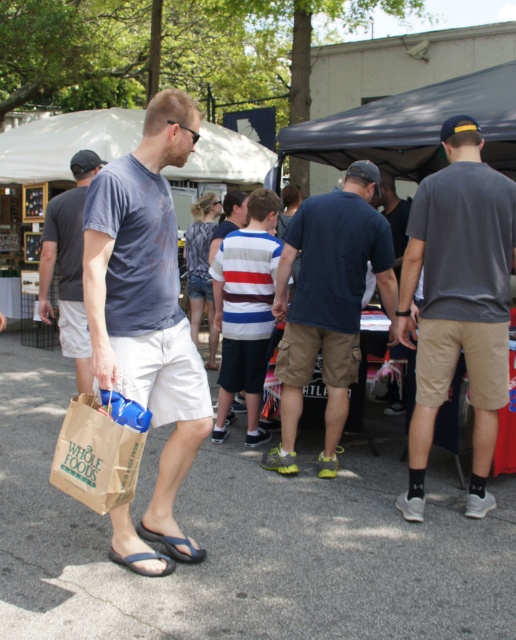
Question: Can you confirm if brown paper bag at lower left is smaller than blue fabric sandal at lower left?

Choices:
 (A) no
 (B) yes

Answer: (A)

Question: Which point is closer to the camera?

Choices:
 (A) brown paper bag at lower left
 (B) matte blue t-shirt at left

Answer: (A)

Question: Where is matte gray t-shirt at center located in relation to dark gray rubber sandal at lower left in the image?

Choices:
 (A) left
 (B) right

Answer: (A)

Question: Can you confirm if dark blue t-shirt at center is positioned to the right of striped cotton shirt at center?

Choices:
 (A) yes
 (B) no

Answer: (A)

Question: Which object appears closest to the camera in this image?

Choices:
 (A) striped cotton shirt at center
 (B) brown paper bag at lower left

Answer: (B)

Question: Which object appears closest to the camera in this image?

Choices:
 (A) dark blue t-shirt at center
 (B) striped cotton shirt at center
 (C) gray cotton t-shirt at right

Answer: (C)